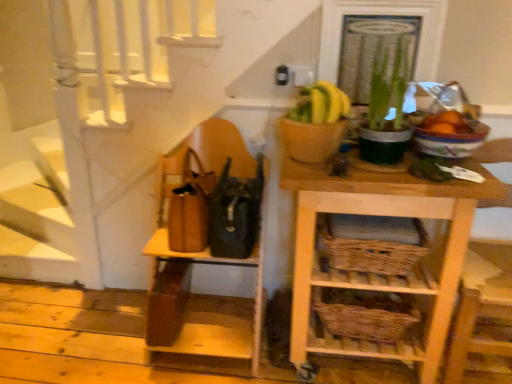
Question: Would you say woven brown basket at lower center, which is the second basket from top to bottom, is outside wooden chair at right?

Choices:
 (A) no
 (B) yes

Answer: (B)

Question: From the image's perspective, is woven brown basket at lower center, which is the second basket from top to bottom, located above wooden chair at right?

Choices:
 (A) no
 (B) yes

Answer: (A)

Question: Is woven brown basket at lower center, which is the second basket from top to bottom, positioned with its back to wooden chair at right?

Choices:
 (A) yes
 (B) no

Answer: (B)

Question: Can you confirm if woven brown basket at lower center, which is the second basket from top to bottom, is shorter than wooden chair at right?

Choices:
 (A) no
 (B) yes

Answer: (B)

Question: Is woven brown basket at lower center, acting as the 1th basket starting from the bottom, behind wooden chair at right?

Choices:
 (A) yes
 (B) no

Answer: (A)

Question: Can you confirm if woven brown basket at lower center, which is the second basket from top to bottom, is positioned to the right of wooden chair at right?

Choices:
 (A) yes
 (B) no

Answer: (B)

Question: Is woven brown basket at lower center, which is the first basket from top to bottom, outside of light wood wicker basket at center right, which ranks as the 2th shelf in left-to-right order?

Choices:
 (A) yes
 (B) no

Answer: (B)

Question: Does woven brown basket at lower center, which appears as the second basket when ordered from the bottom, have a greater width compared to light wood wicker basket at center right, the 1th shelf viewed from the right?

Choices:
 (A) yes
 (B) no

Answer: (B)

Question: Considering the relative sizes of woven brown basket at lower center, which is the first basket from top to bottom, and light wood wicker basket at center right, the 1th shelf viewed from the right, in the image provided, is woven brown basket at lower center, which is the first basket from top to bottom, smaller than light wood wicker basket at center right, the 1th shelf viewed from the right,?

Choices:
 (A) yes
 (B) no

Answer: (A)

Question: Would you say light wood wicker basket at center right, the 1th shelf viewed from the right, is part of woven brown basket at lower center, which appears as the second basket when ordered from the bottom,'s contents?

Choices:
 (A) no
 (B) yes

Answer: (A)

Question: From a real-world perspective, is woven brown basket at lower center, which is the first basket from top to bottom, on light wood wicker basket at center right, which ranks as the 2th shelf in left-to-right order?

Choices:
 (A) no
 (B) yes

Answer: (B)

Question: Is woven brown basket at lower center, which appears as the second basket when ordered from the bottom, touching light wood wicker basket at center right, the 1th shelf viewed from the right?

Choices:
 (A) no
 (B) yes

Answer: (A)

Question: Is green leafy plant at upper right looking in the opposite direction of wooden chair at right?

Choices:
 (A) no
 (B) yes

Answer: (A)